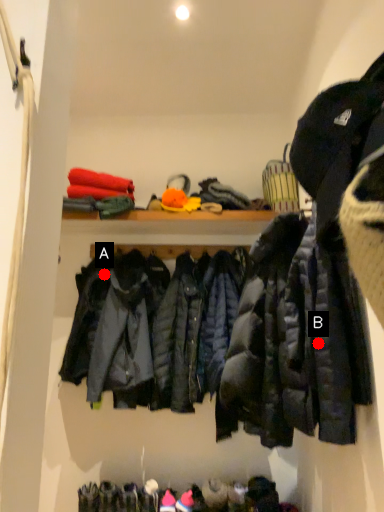
Question: Two points are circled on the image, labeled by A and B beside each circle. Among these points, which one is nearest to the camera?

Choices:
 (A) A is closer
 (B) B is closer

Answer: (B)